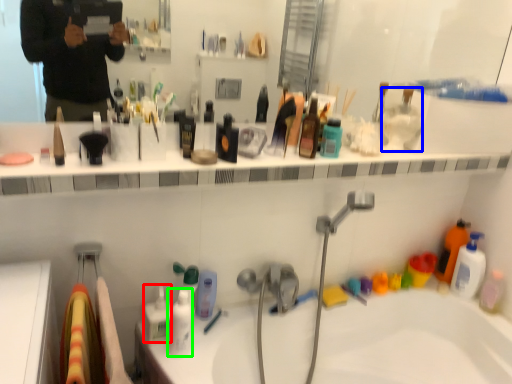
Question: Which object is positioned farthest from toiletry (highlighted by a red box)? Select from toiletry (highlighted by a blue box) and toiletry (highlighted by a green box).

Choices:
 (A) toiletry
 (B) toiletry

Answer: (A)